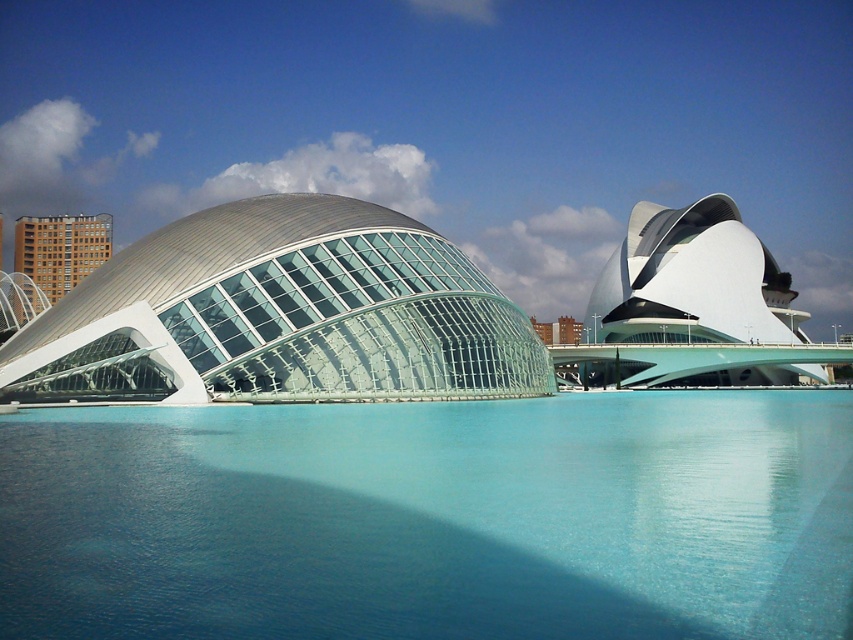
You are an architect designing a new observation deck. You need to ensure visitors can see both the transparent blue water at center and the transparent glass dome at center. Based on their positions, which one will be visible through the other?

The transparent blue water at center is located below the transparent glass dome at center, so the water will be visible through the dome, but the dome cannot be seen through the water since it is above.

You are a tourist standing in the middle of the architectural scene. You want to take a photo that includes both the transparent glass dome at center and the brown brick building at left. Based on their positions, which one should you frame first in your camera viewfinder to ensure both are in the shot?

The transparent glass dome at center is to the right of the brown brick building at left. To include both in the photo, frame the brown brick building at left first since it is on the left side, then adjust the view to include the transparent glass dome at center on the right.

You are a photographer planning to capture the transparent blue water at center and the brown brick building at left in a single wide shot. Based on their widths, which object should you position closer to the center of your frame to ensure both are fully visible?

Since the transparent blue water at center has a lesser width compared to the brown brick building at left, you should position the brown brick building at left closer to the center of your frame. This allows the wider building to be accommodated within the shot while still including the narrower water area.